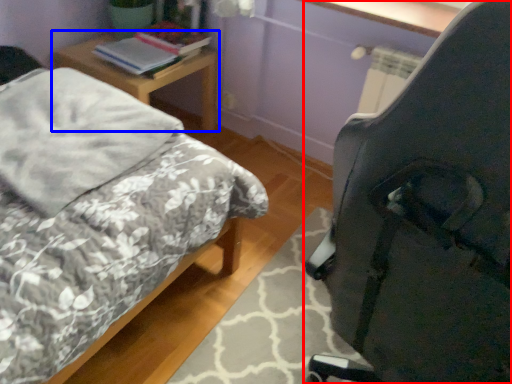
Question: Among these objects, which one is farthest to the camera, chair (highlighted by a red box) or nightstand (highlighted by a blue box)?

Choices:
 (A) chair
 (B) nightstand

Answer: (B)